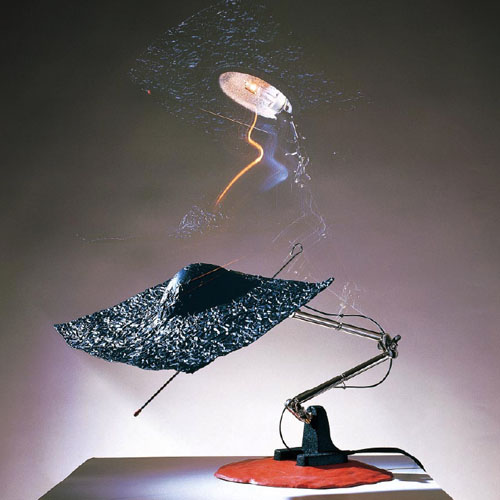
This screenshot has width=500, height=500. In order to click on table in this screenshot , I will do (x=158, y=488).